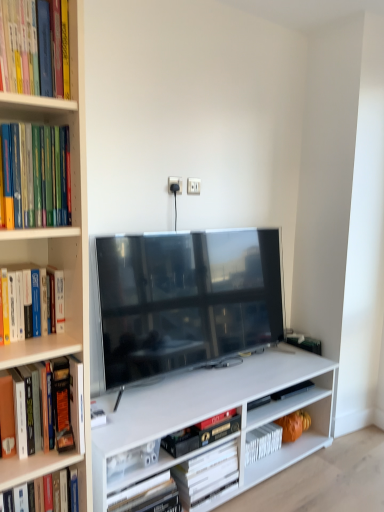
Question: Is hardcover book at lower center, the 4th book viewed from the top, with matte black tv at center?

Choices:
 (A) yes
 (B) no

Answer: (B)

Question: Does hardcover book at lower center, the 1th book from the bottom, have a greater width compared to matte black tv at center?

Choices:
 (A) no
 (B) yes

Answer: (B)

Question: Is matte black tv at center located within hardcover book at lower center, the 4th book viewed from the front?

Choices:
 (A) no
 (B) yes

Answer: (A)

Question: From the image's perspective, would you say hardcover book at lower center, the 4th book viewed from the front, is positioned over matte black tv at center?

Choices:
 (A) yes
 (B) no

Answer: (B)

Question: Is hardcover book at lower center, the 1th book from the bottom, to the right of matte black tv at center from the viewer's perspective?

Choices:
 (A) yes
 (B) no

Answer: (B)

Question: Is hardcover book at lower center, the first book from the back, smaller than matte black tv at center?

Choices:
 (A) no
 (B) yes

Answer: (B)

Question: From a real-world perspective, is hardcover book at center, which is counted as the second book, starting from the bottom, physically above hardcover book at upper left, the fourth book in the back-to-front sequence?

Choices:
 (A) yes
 (B) no

Answer: (B)

Question: Is hardcover book at center, which is the 2th book in back-to-front order, to the right of hardcover book at upper left, the fourth book in the back-to-front sequence, from the viewer's perspective?

Choices:
 (A) no
 (B) yes

Answer: (B)

Question: Can you confirm if hardcover book at center, which is counted as the second book, starting from the bottom, is shorter than hardcover book at upper left, the first book positioned from the front?

Choices:
 (A) no
 (B) yes

Answer: (B)

Question: Considering the relative sizes of hardcover book at center, which is the 3th book in top-to-bottom order, and hardcover book at upper left, which ranks as the 1th book in top-to-bottom order, in the image provided, is hardcover book at center, which is the 3th book in top-to-bottom order, taller than hardcover book at upper left, which ranks as the 1th book in top-to-bottom order,?

Choices:
 (A) yes
 (B) no

Answer: (B)

Question: Is hardcover book at center, which is the 2th book in back-to-front order, facing towards hardcover book at upper left, the fourth book in the back-to-front sequence?

Choices:
 (A) yes
 (B) no

Answer: (B)

Question: Is hardcover book at center, which is the 3th book in top-to-bottom order, wider than hardcover book at upper left, which ranks as the fourth book in bottom-to-top order?

Choices:
 (A) no
 (B) yes

Answer: (A)

Question: Could you tell me if hardcover book at lower center, the 1th book from the bottom, is turned towards hardcover book at upper left, the first book positioned from the front?

Choices:
 (A) yes
 (B) no

Answer: (B)